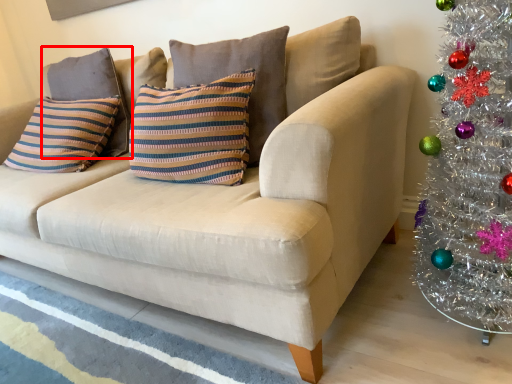
Question: Where is pillow (annotated by the red box) located in relation to pillow in the image?

Choices:
 (A) left
 (B) right

Answer: (A)